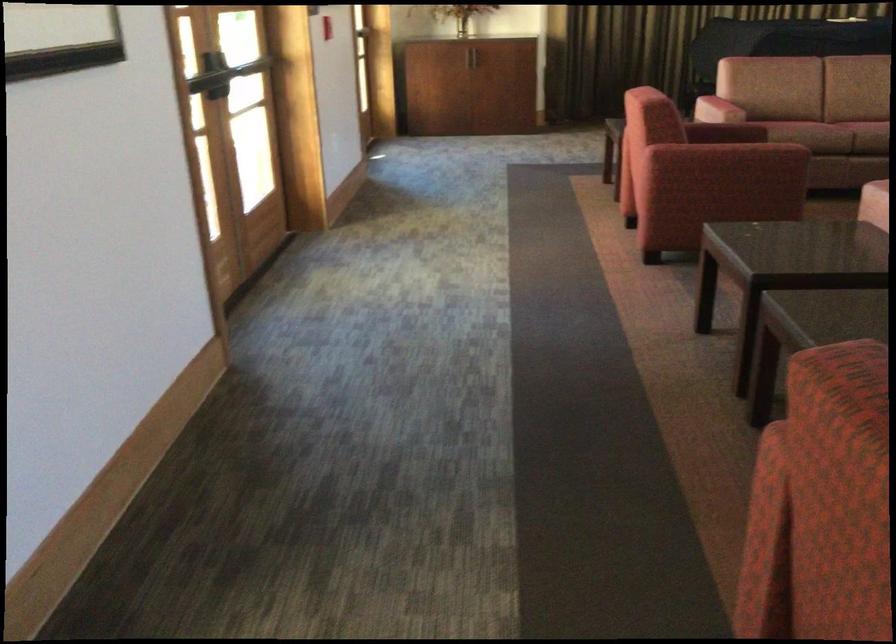
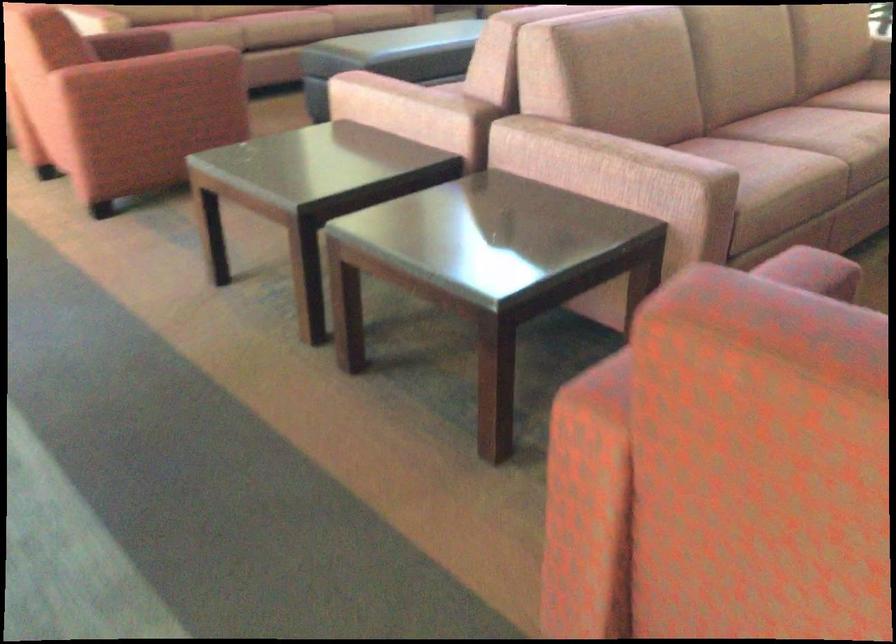
Question: The camera is either moving clockwise (left) or counter-clockwise (right) around the object. The first image is from the beginning of the video and the second image is from the end. Is the camera moving left or right when shooting the video?

Choices:
 (A) Left
 (B) Right

Answer: (A)